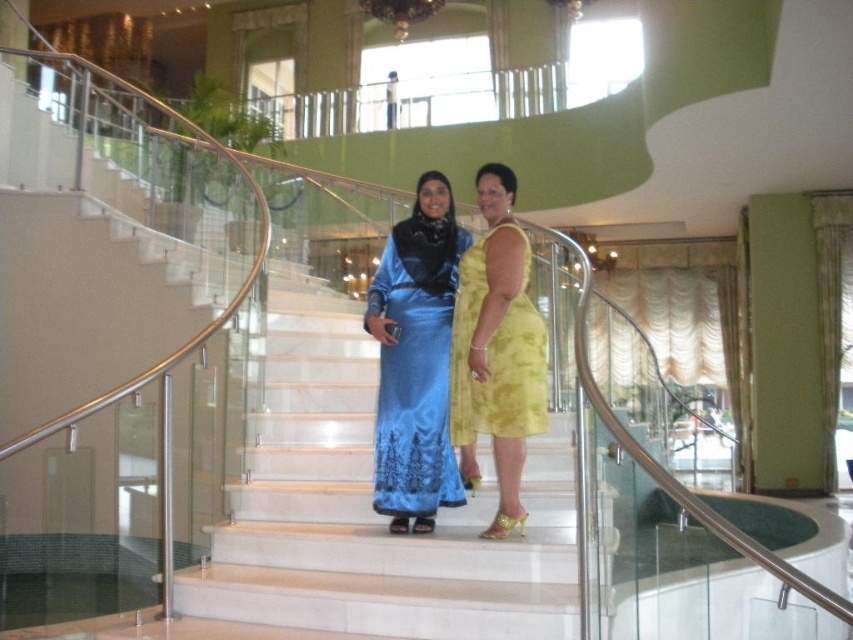
You are an event photographer at a fashion show and need to capture both the satin blue dress at center and the yellow satin dress at center in the same frame. Based on their positions, which dress should you focus on first to ensure both are in the shot?

The satin blue dress at center is below the yellow satin dress at center, so you should focus on the yellow satin dress at center first to ensure both are in the frame.

You are a photographer positioned at the bottom of the white marble stairs at center. You want to take a photo of the yellow satin dress at center. Which direction should you look to capture the dress in your shot?

The white marble stairs at center is below the yellow satin dress at center, so you should look upward to capture the dress in your shot.